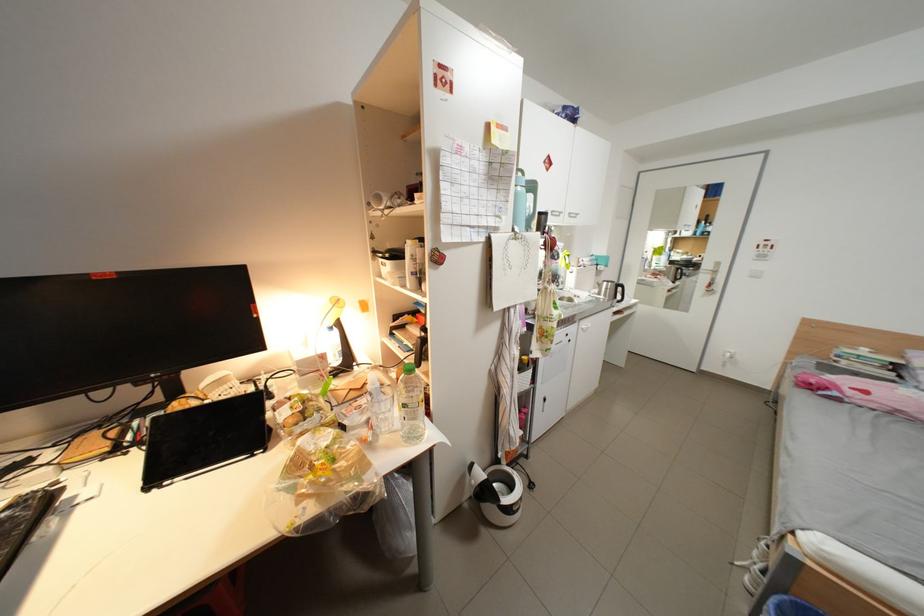
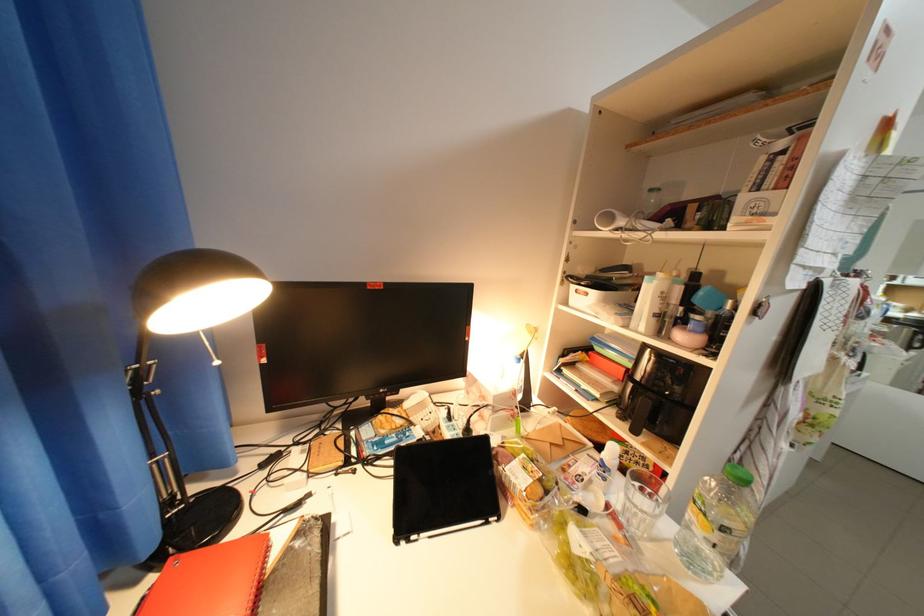
Question: How did the camera likely rotate?

Choices:
 (A) Left
 (B) Right
 (C) Up
 (D) Down

Answer: (A)